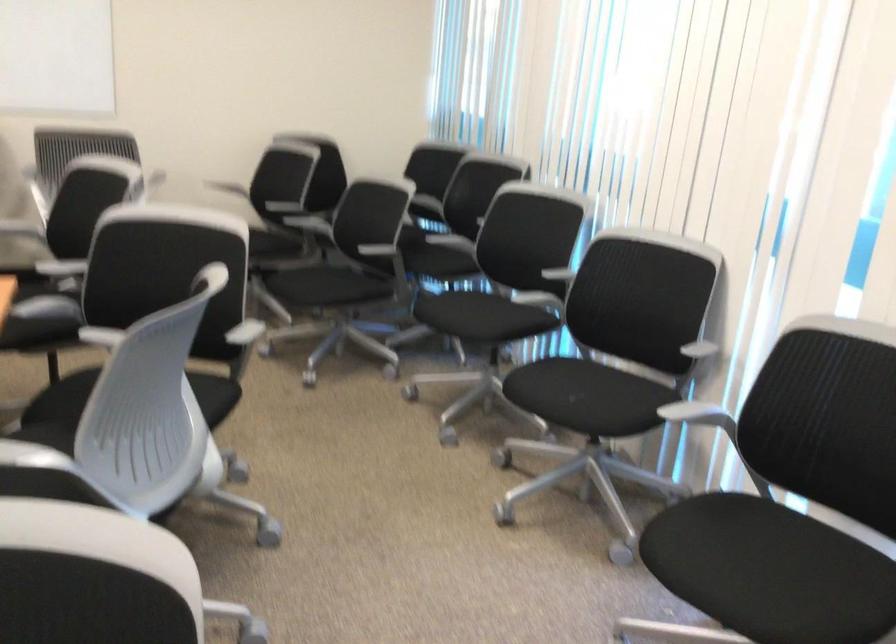
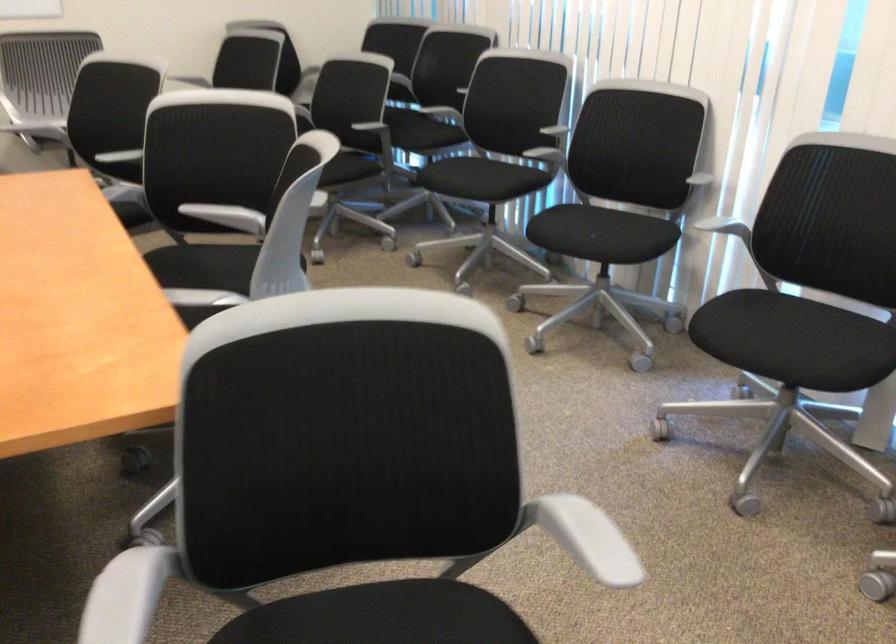
Find the pixel in the second image that matches [698,422] in the first image.

(725, 228)